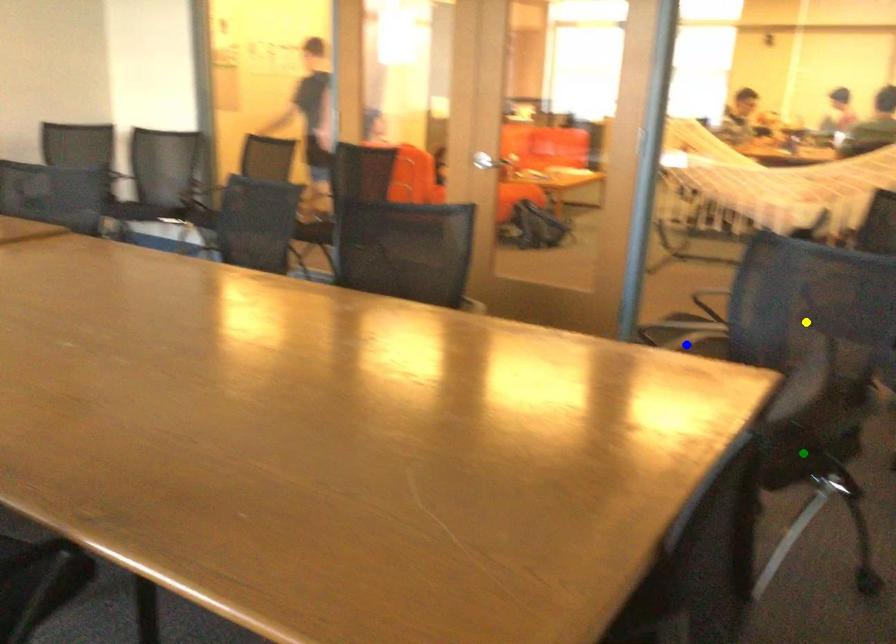
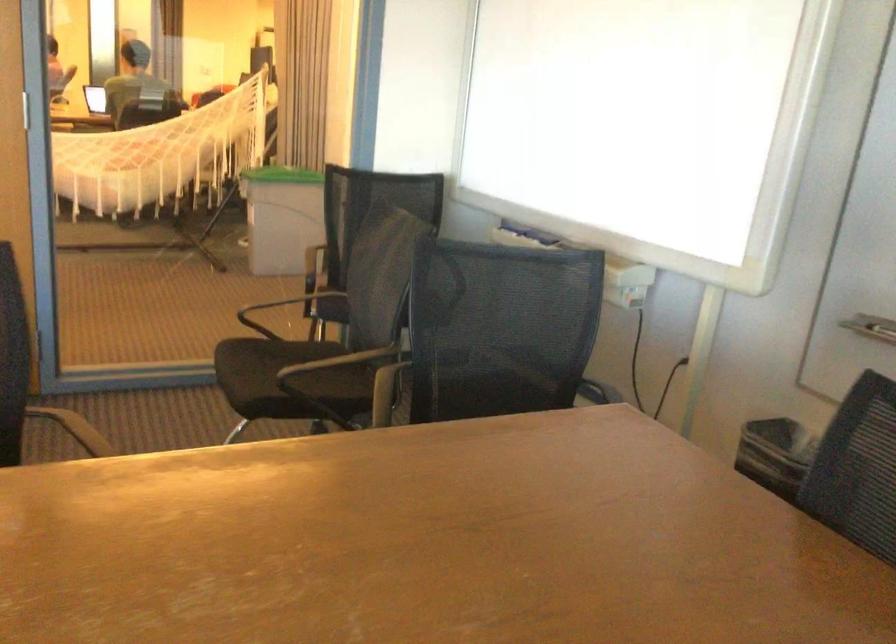
I am providing you with two images of the same scene from different viewpoints. Three points are marked in image1. Which point corresponds to a part or object that is occluded in image2?In image1, three points are marked. Which of them correspond to a part or object that is occluded in image2?Among the three points shown in image1, which one corresponds to a part or object that is no longer visible due to occlusion in image2?

green point cannot be seen in image2.